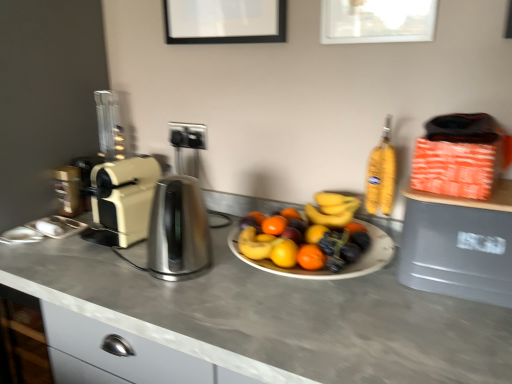
Locate an element on the screen. free location in front of satin silver kettle at center is located at coordinates (174, 306).